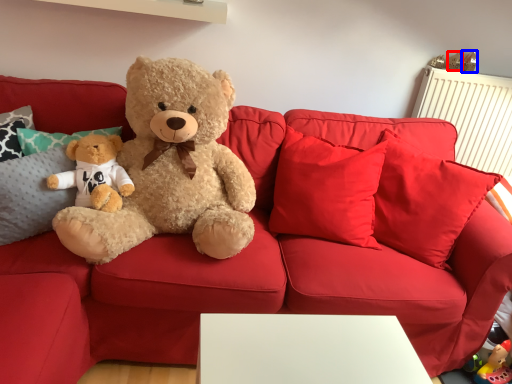
Question: Which object appears farthest to the camera in this image, toy (highlighted by a red box) or toy (highlighted by a blue box)?

Choices:
 (A) toy
 (B) toy

Answer: (B)